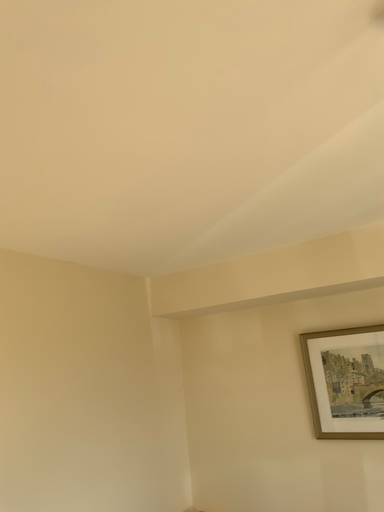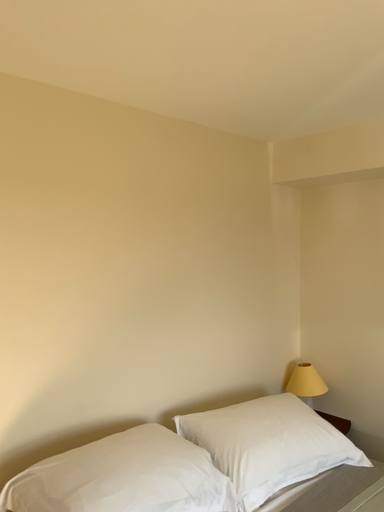
Question: Which way did the camera rotate in the video?

Choices:
 (A) rotated left
 (B) rotated right

Answer: (A)